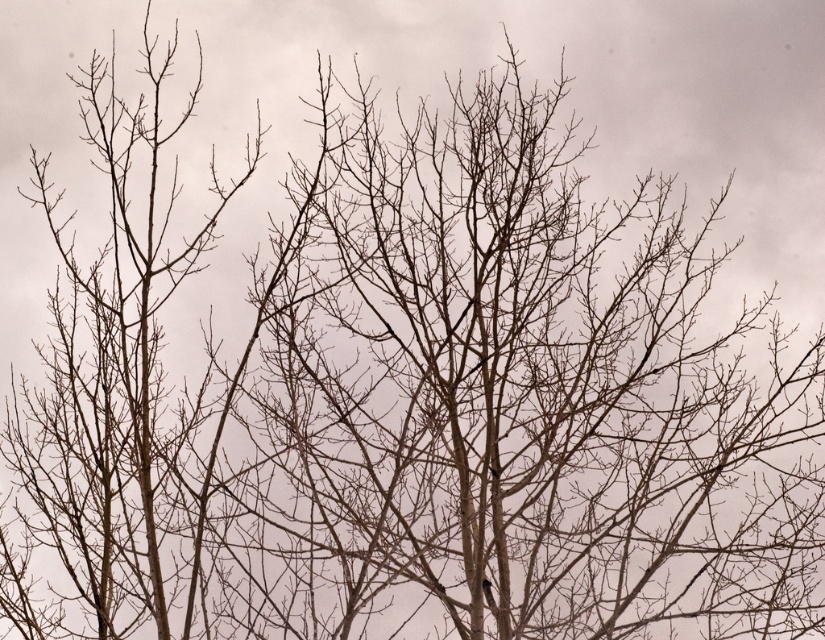
Does brown/dry wood branches at center appear on the right side of brown matte branches at left?

Indeed, brown/dry wood branches at center is positioned on the right side of brown matte branches at left.

Does brown/dry wood branches at center have a smaller size compared to brown matte branches at left?

Actually, brown/dry wood branches at center might be larger than brown matte branches at left.

This screenshot has height=640, width=825. I want to click on brown/dry wood branches at center, so click(x=508, y=403).